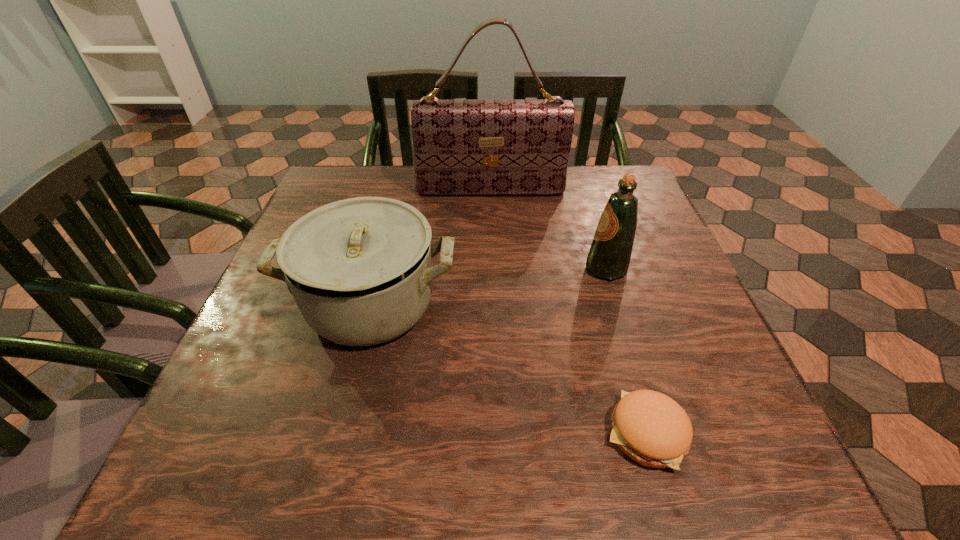
In the image, there is a desktop. Where is `free region at the left edge`? This screenshot has height=540, width=960. free region at the left edge is located at coordinates 278,323.

This screenshot has height=540, width=960. Find the location of `blank area at the right edge`. blank area at the right edge is located at coordinates (600, 215).

Image resolution: width=960 pixels, height=540 pixels. Find the location of `free region at the far left corner of the desktop`. free region at the far left corner of the desktop is located at coordinates (327, 186).

The image size is (960, 540). Find the location of `empty space that is in between the shortest object and the second shortest object`. empty space that is in between the shortest object and the second shortest object is located at coordinates (508, 369).

Where is `empty location between the patty and the olive oil`? The width and height of the screenshot is (960, 540). empty location between the patty and the olive oil is located at coordinates (626, 350).

Identify the location of vacant space that's between the second tallest object and the third tallest object. This screenshot has height=540, width=960. (489, 287).

I want to click on vacant area that lies between the patty and the saucepan, so click(x=508, y=369).

In order to click on free space between the saucepan and the shortest object in this screenshot , I will do `click(508, 369)`.

The width and height of the screenshot is (960, 540). In order to click on vacant point located between the third shortest object and the patty in this screenshot , I will do click(x=626, y=350).

Image resolution: width=960 pixels, height=540 pixels. What are the coordinates of `vacant space that's between the saucepan and the shortest object` in the screenshot? It's located at (508, 369).